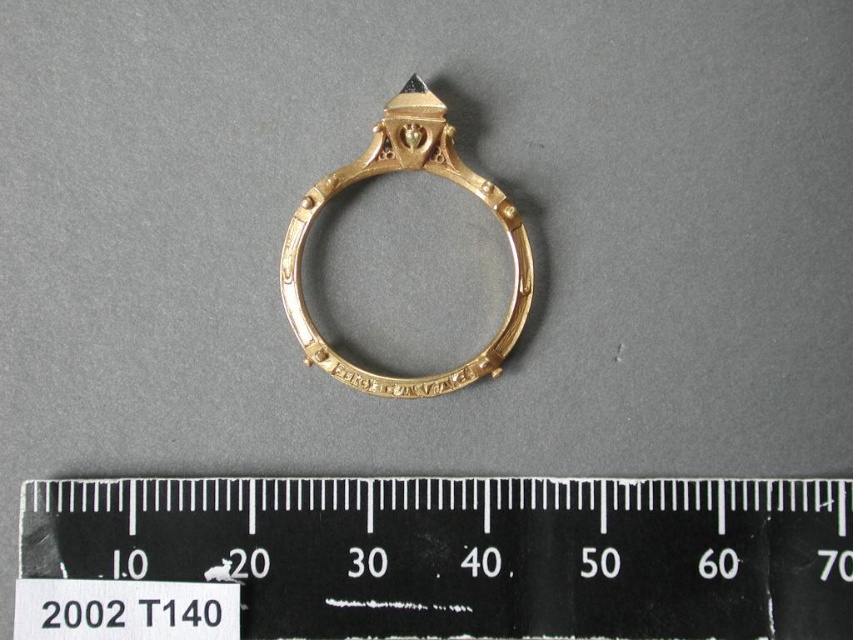
Is black plastic ruler at bottom below gold/yellow metal ring at center?

Yes.

Describe the element at coordinates (434, 557) in the screenshot. I see `black plastic ruler at bottom` at that location.

Is point (634, 625) behind point (335, 369)?

No, (634, 625) is closer to viewer.

You are a GUI agent. You are given a task and a screenshot of the screen. Output one action in this format:
    pyautogui.click(x=<x>, y=<y>)
    Task: Click on the black plastic ruler at bottom
    The width and height of the screenshot is (853, 640).
    Given the screenshot: What is the action you would take?
    pyautogui.click(x=434, y=557)